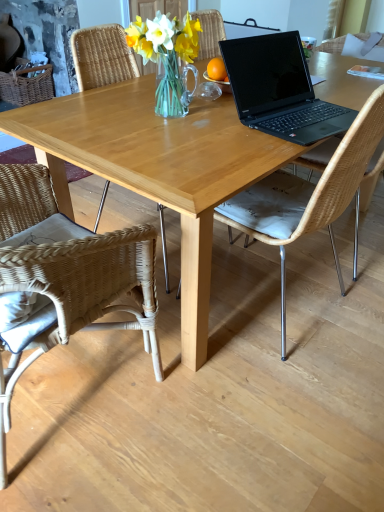
Image resolution: width=384 pixels, height=512 pixels. Identify the location of free spot below woven rattan chair at lower left, positioned as the second chair in right-to-left order (from a real-world perspective). (69, 390).